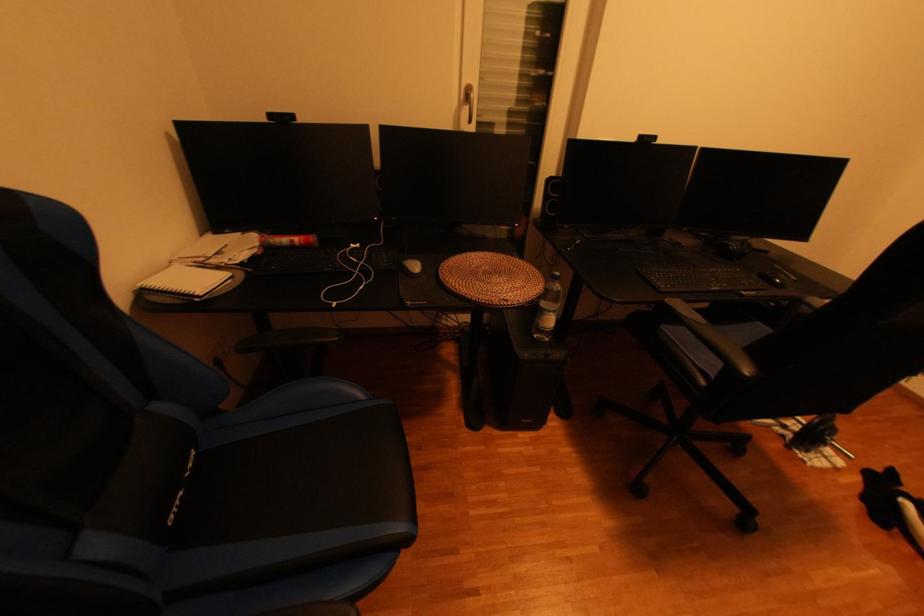
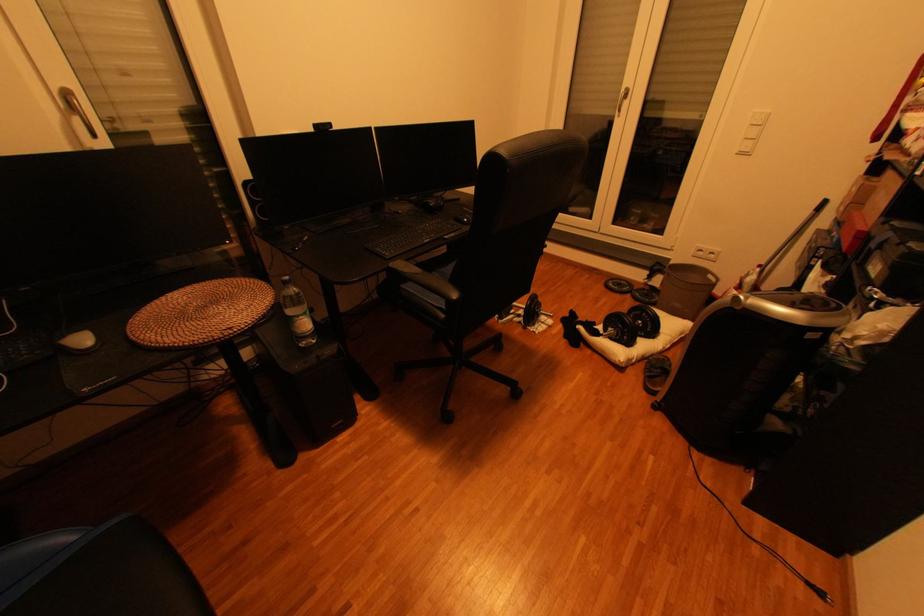
Find the pixel in the second image that matches [477,108] in the first image.

(84, 121)